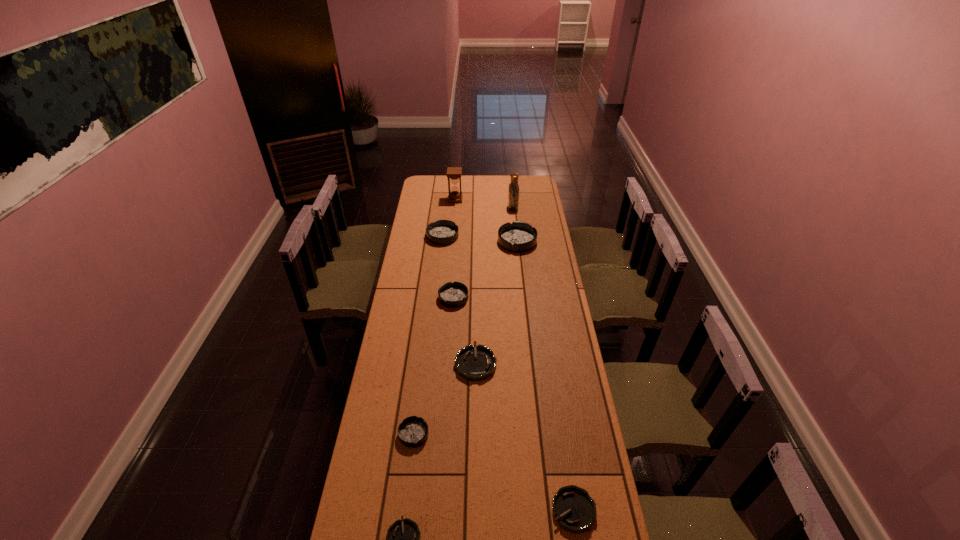
At what (x,y) coordinates should I click in order to perform the action: click on green ashtray that is the second closest to the smallest dark ashtray. Please return your answer as a coordinate pair (x, y). Looking at the image, I should click on (403, 537).

Locate which green ashtray is the second closest to the farthest green ashtray. Please provide its 2D coordinates. Your answer should be formatted as a tuple, i.e. [(x, y)], where the tuple contains the x and y coordinates of a point satisfying the conditions above.

[(403, 537)]

At what (x,y) coordinates should I click in order to perform the action: click on blank area in the image that satisfies the following two spatial constraints: 1. on the front side of the third tallest object; 2. on the left side of the sixth shortest ashtray. Please return your answer as a coordinate pair (x, y). Looking at the image, I should click on (443, 241).